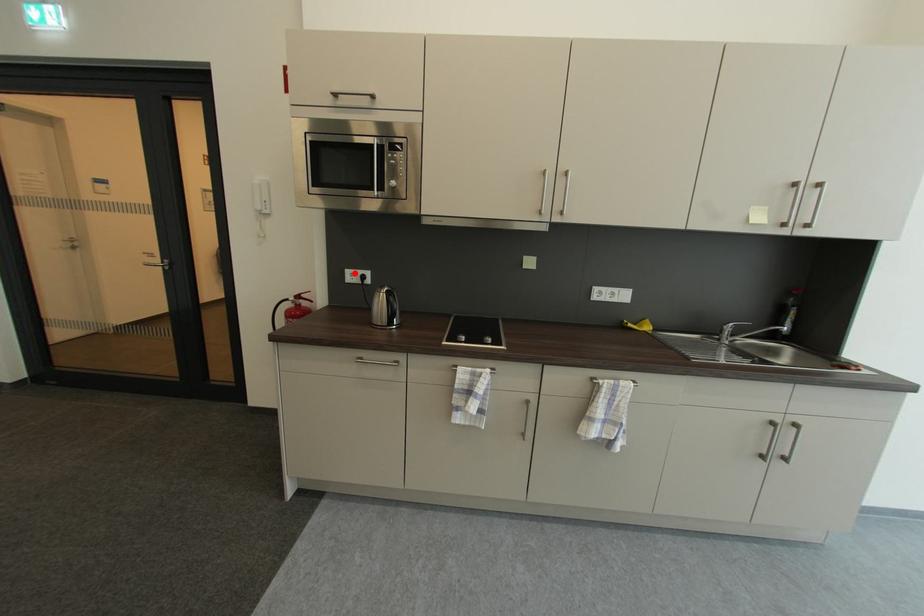
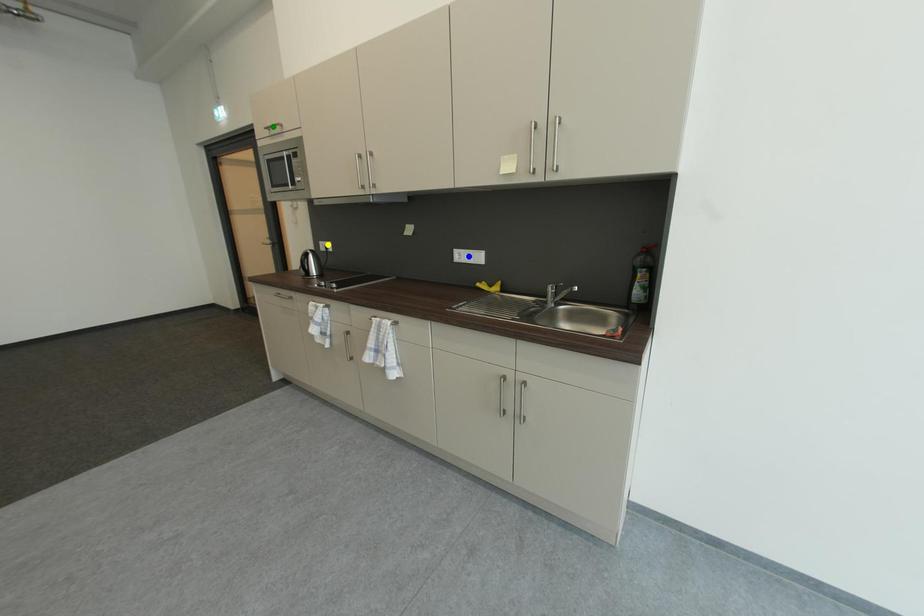
Question: I am providing you with two images of the same scene from different viewpoints. A red point is marked on the first image. You are given multiple points on the second image. Which point in image 2 represents the same 3d spot as the red point in image 1?

Choices:
 (A) green point
 (B) yellow point
 (C) blue point

Answer: (B)